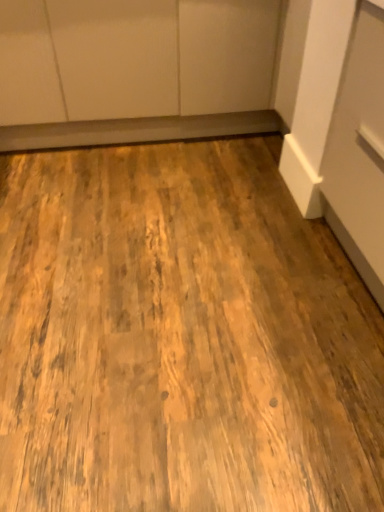
Question: Is matte white cabinetry at upper center shorter than natural wood floor at center?

Choices:
 (A) yes
 (B) no

Answer: (B)

Question: Is matte white cabinetry at upper center thinner than natural wood floor at center?

Choices:
 (A) no
 (B) yes

Answer: (B)

Question: Is matte white cabinetry at upper center outside of natural wood floor at center?

Choices:
 (A) no
 (B) yes

Answer: (B)

Question: Is matte white cabinetry at upper center positioned far away from natural wood floor at center?

Choices:
 (A) yes
 (B) no

Answer: (B)

Question: Considering the relative positions of matte white cabinetry at upper center and natural wood floor at center in the image provided, is matte white cabinetry at upper center behind natural wood floor at center?

Choices:
 (A) no
 (B) yes

Answer: (B)

Question: Is matte white cabinetry at upper center looking in the opposite direction of natural wood floor at center?

Choices:
 (A) no
 (B) yes

Answer: (A)

Question: Can you confirm if natural wood floor at center is positioned to the right of matte white cabinetry at upper center?

Choices:
 (A) yes
 (B) no

Answer: (A)

Question: Is natural wood floor at center positioned with its back to matte white cabinetry at upper center?

Choices:
 (A) no
 (B) yes

Answer: (A)

Question: Would you consider natural wood floor at center to be distant from matte white cabinetry at upper center?

Choices:
 (A) no
 (B) yes

Answer: (A)

Question: Is the position of natural wood floor at center more distant than that of matte white cabinetry at upper center?

Choices:
 (A) no
 (B) yes

Answer: (A)

Question: Is natural wood floor at center taller than matte white cabinetry at upper center?

Choices:
 (A) no
 (B) yes

Answer: (A)

Question: Considering the relative sizes of natural wood floor at center and matte white cabinetry at upper center in the image provided, is natural wood floor at center thinner than matte white cabinetry at upper center?

Choices:
 (A) yes
 (B) no

Answer: (B)

Question: Based on their sizes in the image, would you say natural wood floor at center is bigger or smaller than matte white cabinetry at upper center?

Choices:
 (A) small
 (B) big

Answer: (A)